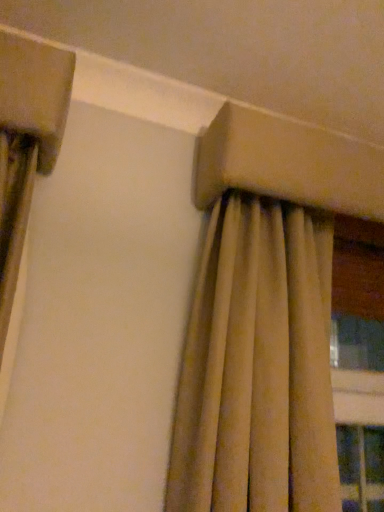
Find the location of `beige velvet curtain at upper right`. beige velvet curtain at upper right is located at coordinates (257, 367).

What do you see at coordinates (257, 367) in the screenshot? I see `beige velvet curtain at upper right` at bounding box center [257, 367].

Where is `beige velvet curtain at upper right`? This screenshot has width=384, height=512. beige velvet curtain at upper right is located at coordinates coord(257,367).